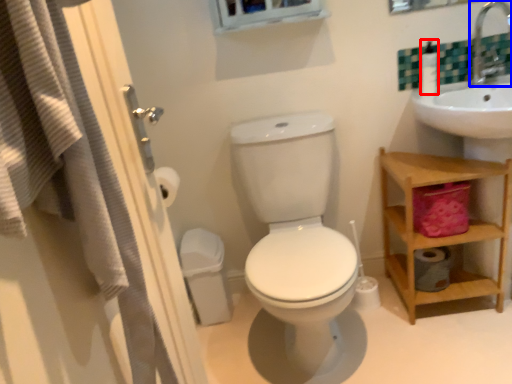
Question: Which of the following is the farthest to the observer, soap dispenser (highlighted by a red box) or faucet (highlighted by a blue box)?

Choices:
 (A) soap dispenser
 (B) faucet

Answer: (A)